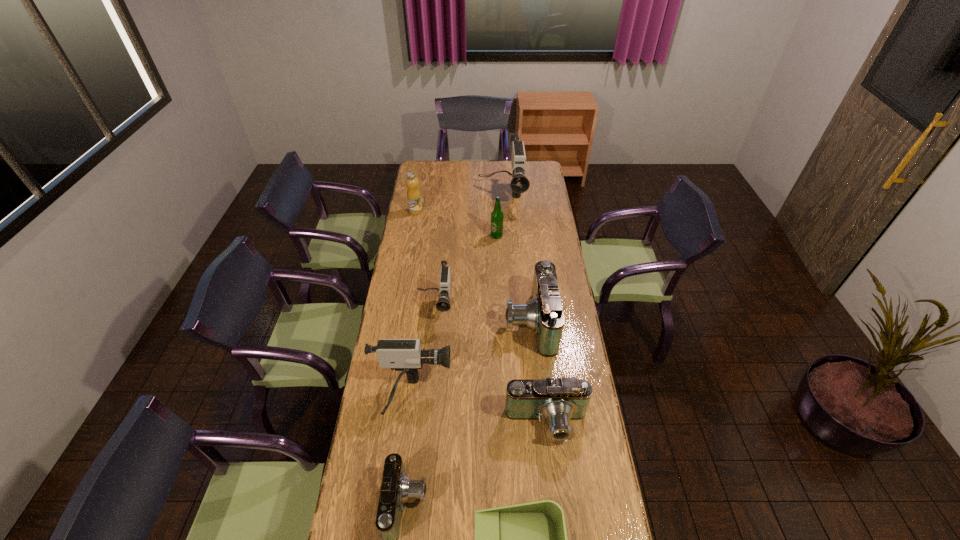
The height and width of the screenshot is (540, 960). What are the coordinates of `free space located on the front label of the fruit juice` in the screenshot? It's located at (488, 211).

Locate an element on the screen. free space located 0.210m on the label of the third farthest object is located at coordinates (498, 267).

The width and height of the screenshot is (960, 540). Identify the location of vacant region located 0.360m on the recording direction of the nearest white camcorder. (545, 396).

The width and height of the screenshot is (960, 540). Find the location of `vacant space located on the front-facing side of the farthest blue camcorder`. vacant space located on the front-facing side of the farthest blue camcorder is located at coordinates (432, 322).

This screenshot has height=540, width=960. Find the location of `free space located on the front-facing side of the farthest blue camcorder`. free space located on the front-facing side of the farthest blue camcorder is located at coordinates [491, 322].

Identify the location of vacant area situated on the front-facing side of the farthest blue camcorder. (427, 322).

You are a GUI agent. You are given a task and a screenshot of the screen. Output one action in this format:
    pyautogui.click(x=<x>, y=<y>)
    Task: Click on the vacant space located 0.140m on the front-facing side of the second farthest blue camcorder
    
    Given the screenshot: What is the action you would take?
    pyautogui.click(x=554, y=490)

In order to click on free location located 0.200m on the recording direction of the second nearest white camcorder in this screenshot , I will do pos(429,363).

Find the location of `object at the far edge`. object at the far edge is located at coordinates (519, 184).

Find the location of a particular element. fruit juice present at the left edge is located at coordinates (413, 193).